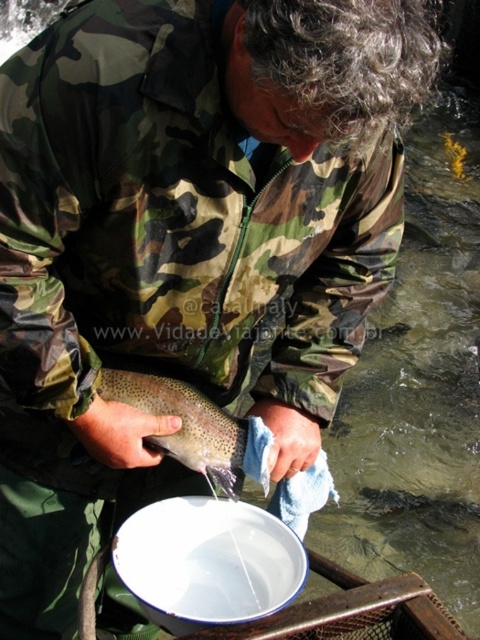
Is white enamel plate at lower center smaller than speckled skin fish at center?

Correct, white enamel plate at lower center occupies less space than speckled skin fish at center.

Is point (194, 595) positioned before point (207, 401)?

That is True.

Where is `white enamel plate at lower center`? Image resolution: width=480 pixels, height=640 pixels. white enamel plate at lower center is located at coordinates (x=207, y=563).